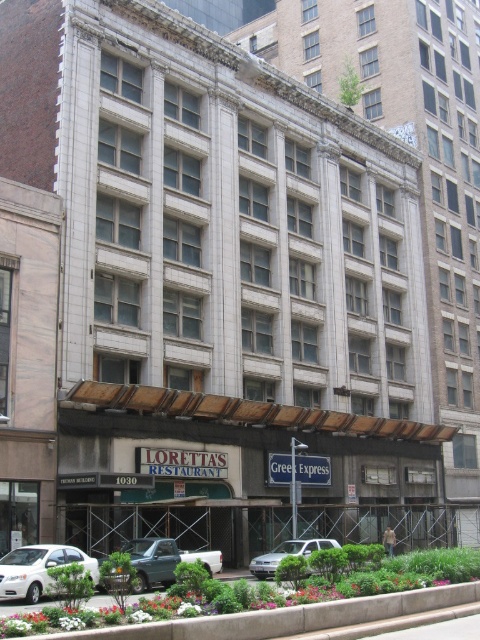
Between green grass at lower center and white matte sedan at lower left, which one appears on the left side from the viewer's perspective?

Positioned to the left is white matte sedan at lower left.

Who is shorter, green grass at lower center or white matte sedan at lower left?

Standing shorter between the two is white matte sedan at lower left.

The image size is (480, 640). Find the location of `green grass at lower center`. green grass at lower center is located at coordinates (360, 580).

Between green grass at lower center and silver metallic sedan at center, which one is positioned higher?

green grass at lower center is above.

This screenshot has height=640, width=480. What do you see at coordinates (360, 580) in the screenshot?
I see `green grass at lower center` at bounding box center [360, 580].

Does point (374, 595) lie in front of point (262, 566)?

Yes, it is.

Identify the location of green grass at lower center. click(x=360, y=580).

Is point (132, 582) in front of point (296, 544)?

Yes, point (132, 582) is closer to viewer.

Which is in front, point (151, 570) or point (333, 544)?

Positioned in front is point (151, 570).

The width and height of the screenshot is (480, 640). What are the coordinates of `green metallic truck at lower center` in the screenshot? It's located at (164, 561).